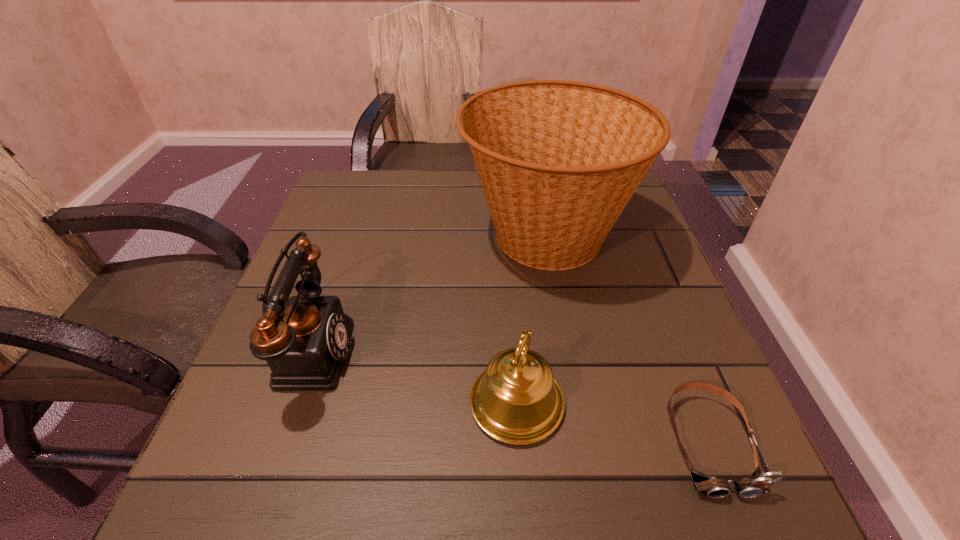
The image size is (960, 540). In the image, there is a desktop. Identify the location of vacant region at the near left corner. (280, 468).

At what (x,y) coordinates should I click in order to perform the action: click on free spot between the leftmost object and the bell. Please return your answer as a coordinate pair (x, y). Looking at the image, I should click on (413, 376).

Identify the location of free spot between the third tallest object and the goggles. The height and width of the screenshot is (540, 960). (612, 422).

The height and width of the screenshot is (540, 960). I want to click on free spot between the leftmost object and the tallest object, so click(427, 293).

Where is `free point between the tallest object and the bell`? free point between the tallest object and the bell is located at coordinates (531, 320).

Locate an element on the screen. This screenshot has height=540, width=960. empty space between the basket and the second shortest object is located at coordinates (531, 320).

In order to click on free space that is in between the second shortest object and the basket in this screenshot , I will do `click(531, 320)`.

Image resolution: width=960 pixels, height=540 pixels. I want to click on empty location between the farthest object and the leftmost object, so click(427, 293).

The height and width of the screenshot is (540, 960). I want to click on vacant point located between the basket and the bell, so click(x=531, y=320).

Find the location of a particular element. The image size is (960, 540). object that is the second closest to the goggles is located at coordinates (558, 160).